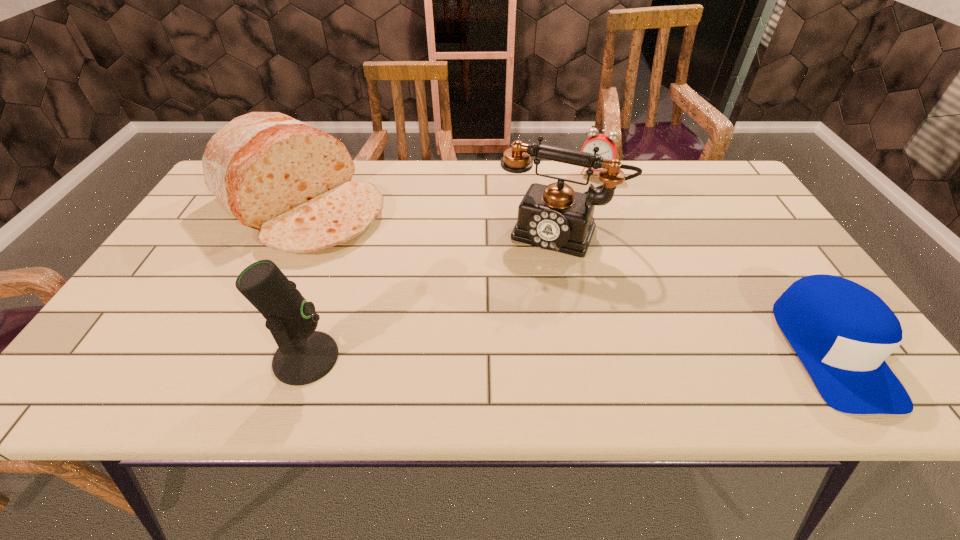
Where is `vacant space on the desktop that is between the microphone and the baseball cap and is positioned on the front of the telephone at the rotary dial`? This screenshot has height=540, width=960. vacant space on the desktop that is between the microphone and the baseball cap and is positioned on the front of the telephone at the rotary dial is located at coordinates (507, 355).

Find the location of a particular element. vacant space on the desktop that is between the microphone and the baseball cap and is positioned on the front-facing side of the alarm clock is located at coordinates [517, 354].

At what (x,y) coordinates should I click in order to perform the action: click on vacant space on the desktop that is between the microphone and the baseball cap and is positioned at the sliced end of the bread. Please return your answer as a coordinate pair (x, y). The image size is (960, 540). Looking at the image, I should click on (513, 355).